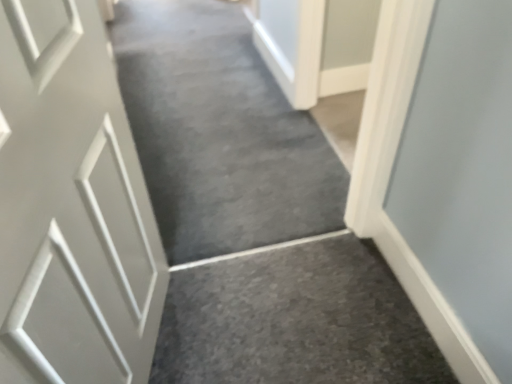
Question: Looking at their shapes, would you say gray carpet at center is wider or thinner than white matte door at left?

Choices:
 (A) thin
 (B) wide

Answer: (B)

Question: Considering the positions of point (211, 125) and point (121, 180), is point (211, 125) closer or farther from the camera than point (121, 180)?

Choices:
 (A) closer
 (B) farther

Answer: (B)

Question: Is gray carpet at center inside the boundaries of white matte door at left, or outside?

Choices:
 (A) inside
 (B) outside

Answer: (B)

Question: From their relative heights in the image, would you say white matte door at left is taller or shorter than gray carpet at center?

Choices:
 (A) short
 (B) tall

Answer: (B)

Question: Is point (41, 142) positioned closer to the camera than point (181, 170)?

Choices:
 (A) closer
 (B) farther

Answer: (A)

Question: Looking at their shapes, would you say white matte door at left is wider or thinner than gray carpet at center?

Choices:
 (A) wide
 (B) thin

Answer: (B)

Question: Considering the positions of white matte door at left and gray carpet at center in the image, is white matte door at left bigger or smaller than gray carpet at center?

Choices:
 (A) big
 (B) small

Answer: (B)